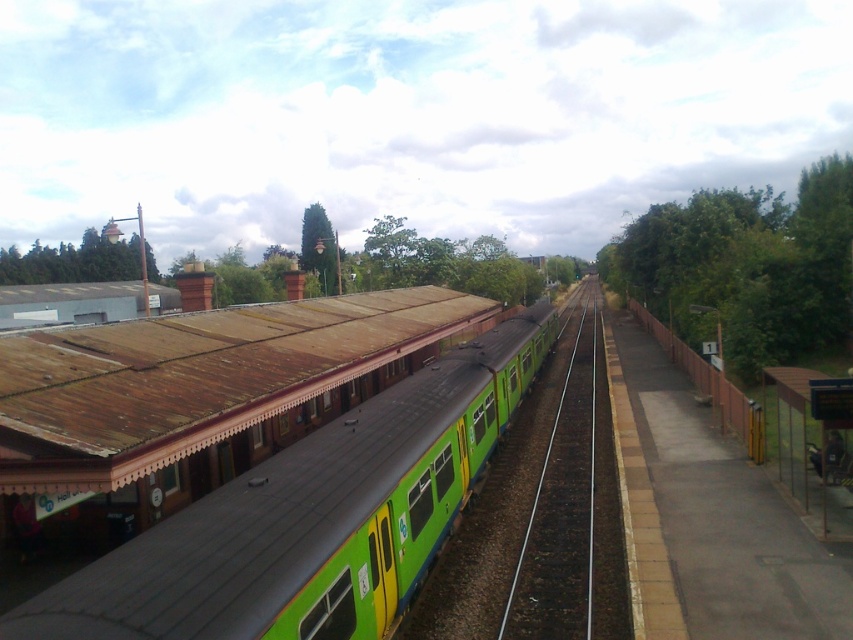
Which is in front, point (451, 492) or point (540, 596)?

Point (540, 596) is in front.

At what (x,y) coordinates should I click in order to perform the action: click on green matte train at center. Please return your answer as a coordinate pair (x, y). Looking at the image, I should click on (312, 516).